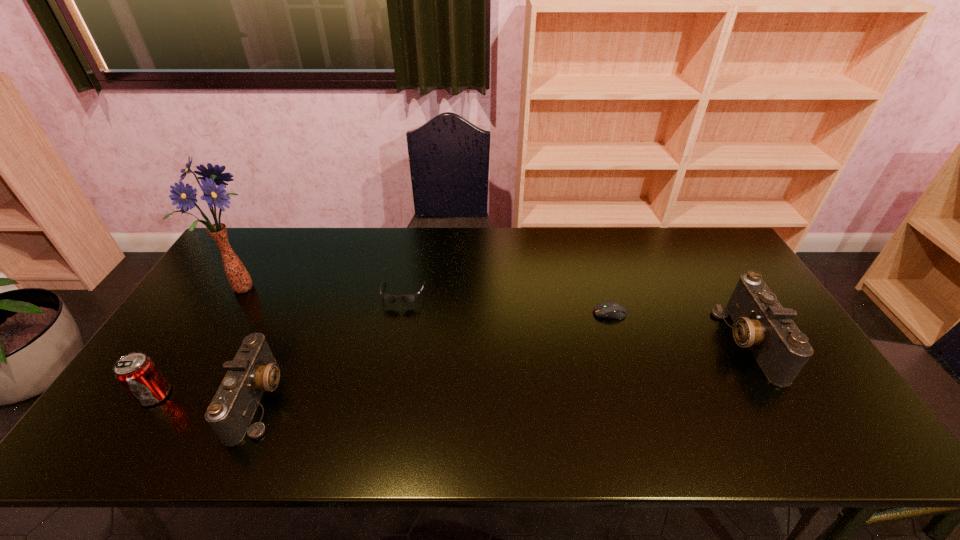
I want to click on the fourth object from right to left, so click(253, 370).

Where is `the shorter camera`? the shorter camera is located at coordinates (253, 370).

Identify the location of the rightmost object. (761, 324).

This screenshot has height=540, width=960. Find the location of `the taller camera`. the taller camera is located at coordinates tap(761, 324).

The image size is (960, 540). Identify the location of the tallest object. (238, 277).

You are a GUI agent. You are given a task and a screenshot of the screen. Output one action in this format:
    pyautogui.click(x=<x>, y=<y>)
    Task: Click on the sunglasses
    This screenshot has width=960, height=540.
    Given the screenshot: What is the action you would take?
    pyautogui.click(x=409, y=298)

This screenshot has height=540, width=960. Find the location of `the fourth object from left to right`. the fourth object from left to right is located at coordinates (409, 298).

Locate an element on the screen. the fifth object from left to right is located at coordinates (614, 310).

Locate an element on the screen. The image size is (960, 540). the shortest object is located at coordinates (614, 310).

Find the location of a particular element. This screenshot has height=540, width=960. pop soda is located at coordinates (137, 373).